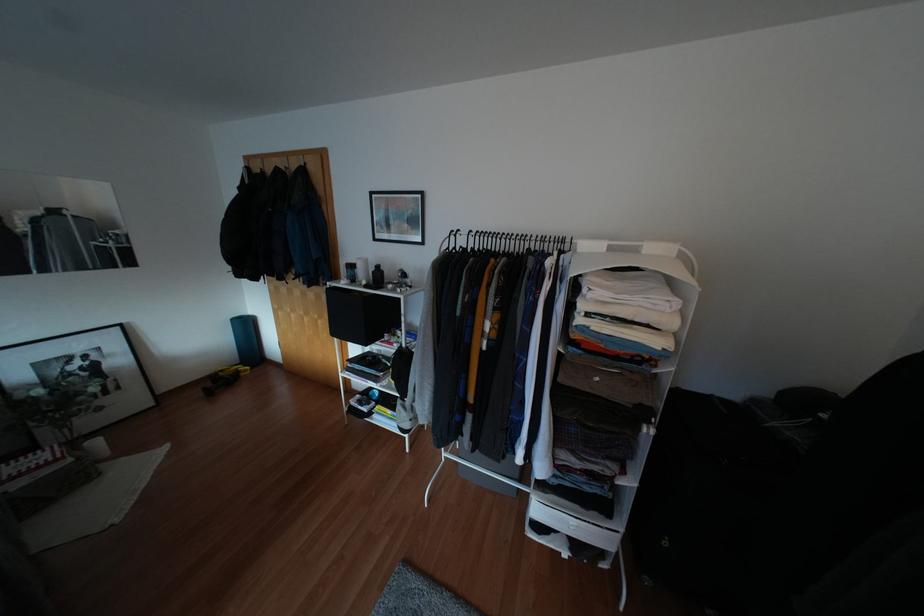
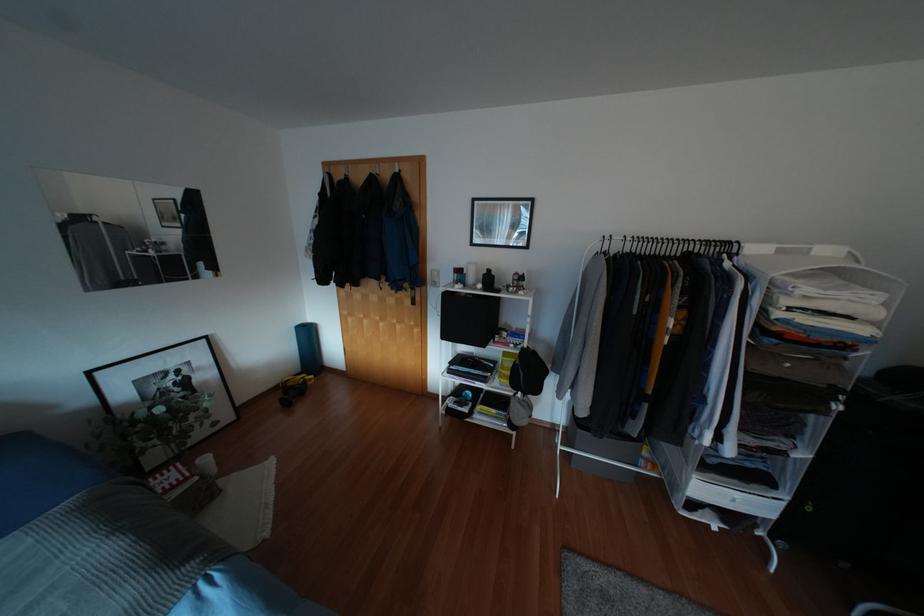
The point at (94, 442) is marked in the first image. Where is the corresponding point in the second image?

(205, 459)